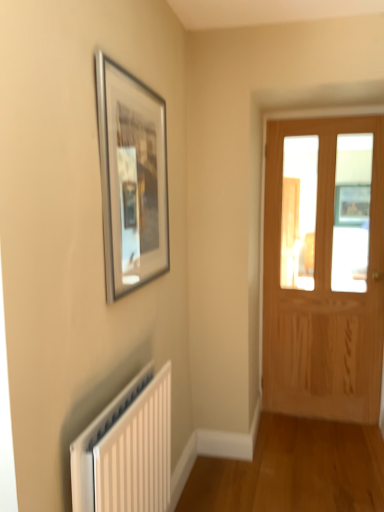
This screenshot has width=384, height=512. Identify the location of vacant space underneath light brown wooden door at right (from a real-world perspective). (316, 419).